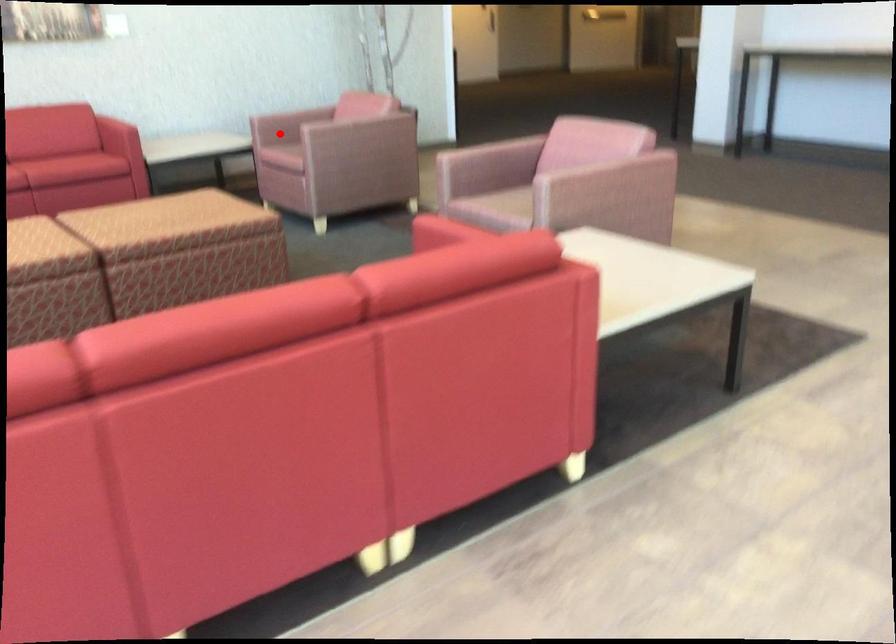
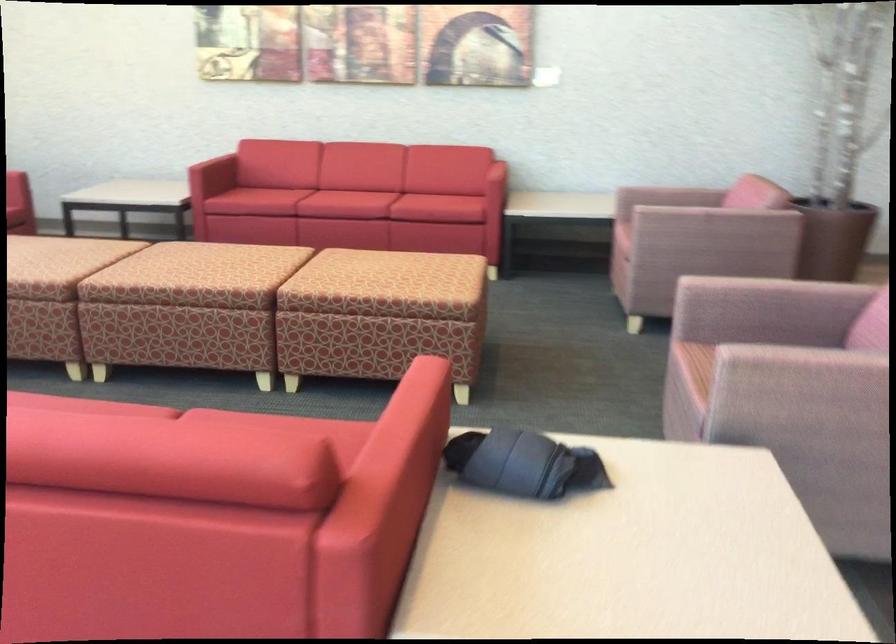
In the second image, find the point that corresponds to the highlighted location in the first image.

(624, 218)